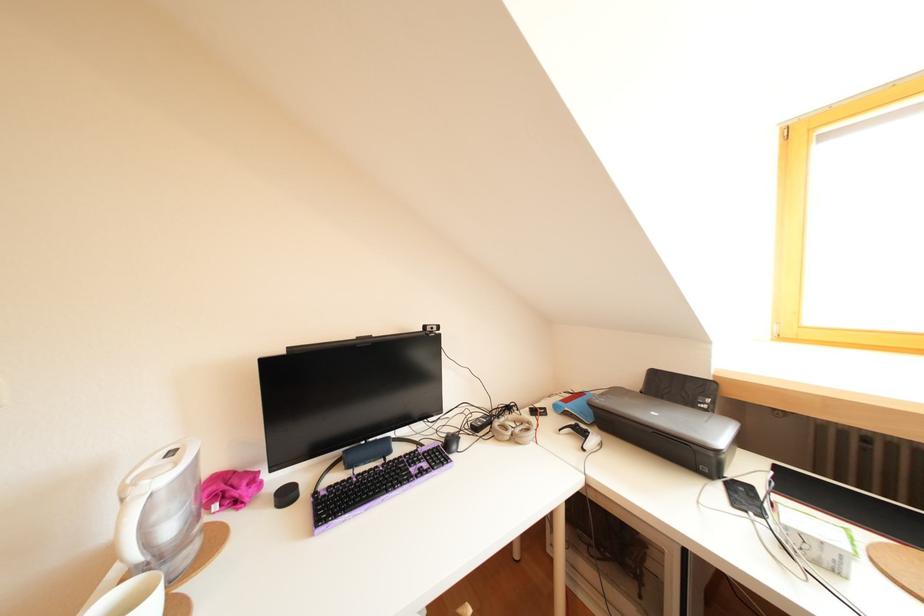
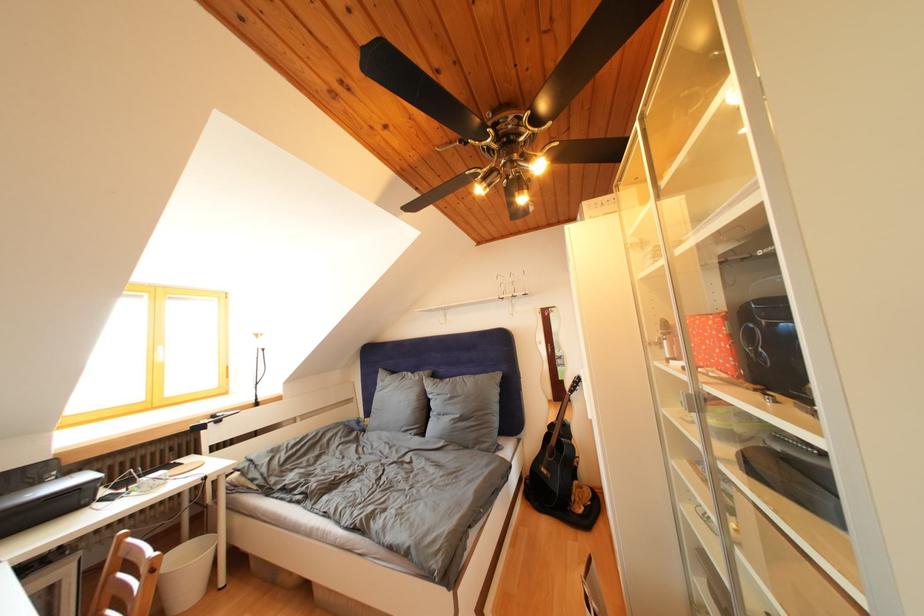
The point at (699,407) is marked in the first image. Where is the corresponding point in the second image?

(44, 488)